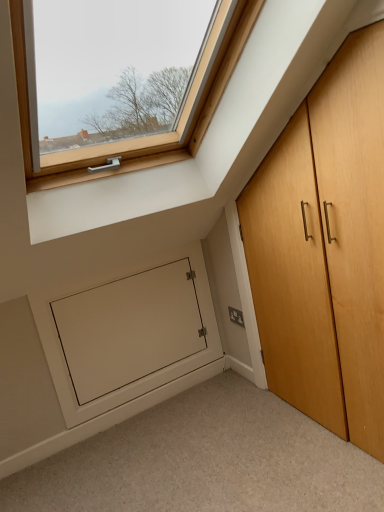
This screenshot has height=512, width=384. Find the location of `satin silver plate at lower right`. satin silver plate at lower right is located at coordinates (236, 316).

Measure the distance between light brown wood cupboard at right and camera.

3.78 feet.

What do you see at coordinates (129, 329) in the screenshot? Image resolution: width=384 pixels, height=512 pixels. I see `white matte door at lower left` at bounding box center [129, 329].

Find the location of a particular element. The height and width of the screenshot is (512, 384). satin silver plate at lower right is located at coordinates (236, 316).

Is white matte door at lower left inside the boundaries of white matte door at lower left, or outside?

white matte door at lower left is outside white matte door at lower left.

Is white matte door at lower left facing towards white matte door at lower left?

No.

Is white matte door at lower left wider or thinner than white matte door at lower left?

In the image, white matte door at lower left appears to be wider than white matte door at lower left.

Does white matte door at lower left have a greater height compared to white matte door at lower left?

No.

Between point (383, 70) and point (234, 308), which one is positioned in front?

The point (383, 70) is closer.

Is light brown wood cupboard at right not close to satin silver plate at lower right?

That's not correct — light brown wood cupboard at right is a little close to satin silver plate at lower right.

Visually, is light brown wood cupboard at right positioned to the left or to the right of satin silver plate at lower right?

light brown wood cupboard at right is to the right of satin silver plate at lower right.

Is light brown wood cupboard at right oriented towards satin silver plate at lower right?

No.

Do you think satin silver plate at lower right is within light brown wood cupboard at right, or outside of it?

satin silver plate at lower right is located beyond the bounds of light brown wood cupboard at right.

From a real-world perspective, which object stands above the other?

light brown wood cupboard at right.

Is satin silver plate at lower right positioned with its back to light brown wood cupboard at right?

No, satin silver plate at lower right's orientation is not away from light brown wood cupboard at right.

Is satin silver plate at lower right to the right of light brown wood cupboard at right from the viewer's perspective?

No.

Find the location of a particular element. This screenshot has width=384, height=512. corridor located underneath the satin silver plate at lower right (from a real-world perspective) is located at coordinates click(205, 461).

From the picture: From a real-world perspective, is white matte door at lower left above or below satin silver plate at lower right?

From a real-world perspective, white matte door at lower left is physically below satin silver plate at lower right.

Would you consider white matte door at lower left to be distant from satin silver plate at lower right?

They are positioned close to each other.

Which object is positioned more to the right, white matte door at lower left or satin silver plate at lower right?

satin silver plate at lower right is more to the right.

Considering the sizes of objects white matte door at lower left and satin silver plate at lower right in the image provided, who is taller, white matte door at lower left or satin silver plate at lower right?

white matte door at lower left.

From the image's perspective, is white matte door at lower left above satin silver plate at lower right?

No.

Looking at their sizes, would you say white matte door at lower left is wider or thinner than satin silver plate at lower right?

white matte door at lower left is thinner than satin silver plate at lower right.

How many degrees apart are the facing directions of satin silver plate at lower right and white matte door at lower left?

90 degrees separate the facing orientations of satin silver plate at lower right and white matte door at lower left.

From a real-world perspective, which object rests below the other?

satin silver plate at lower right, from a real-world perspective.

Which of these two, satin silver plate at lower right or white matte door at lower left, is smaller?

satin silver plate at lower right is smaller.

Where is `electric outlet that appears above the white matte door at lower left (from the image's perspective)`? electric outlet that appears above the white matte door at lower left (from the image's perspective) is located at coordinates (236, 316).

How different are the orientations of white matte door at lower left and light brown wood cupboard at right in degrees?

white matte door at lower left and light brown wood cupboard at right are facing 90 degrees away from each other.

From a real-world perspective, is white matte door at lower left on top of light brown wood cupboard at right?

No.

Is the depth of white matte door at lower left less than that of light brown wood cupboard at right?

No, it is not.

Can light brown wood cupboard at right be found inside white matte door at lower left?

Definitely not — light brown wood cupboard at right is not inside white matte door at lower left.

Find the location of `corridor in front of the white matte door at lower left`. corridor in front of the white matte door at lower left is located at coordinates (205, 461).

Locate an element on the screen. The image size is (384, 512). cupboard on the right of satin silver plate at lower right is located at coordinates (325, 248).

Looking at the image, which one is located closer to white matte door at lower left, light brown wood cupboard at right or satin silver plate at lower right?

The object closer to white matte door at lower left is light brown wood cupboard at right.

Considering their positions, is white matte door at lower left positioned closer to satin silver plate at lower right than light brown wood cupboard at right?

light brown wood cupboard at right is positioned closer to the anchor satin silver plate at lower right.

Based on the photo, from the image, which object appears to be farther from light brown wood cupboard at right, satin silver plate at lower right or white matte door at lower left?

The object further to light brown wood cupboard at right is white matte door at lower left.

Based on their spatial positions, is white matte door at lower left or light brown wood cupboard at right further from white matte door at lower left?

Based on the image, light brown wood cupboard at right appears to be further to white matte door at lower left.

From the image, which object appears to be nearer to satin silver plate at lower right, white matte door at lower left or light brown wood cupboard at right?

The object closer to satin silver plate at lower right is white matte door at lower left.

Considering their positions, is light brown wood cupboard at right positioned further to satin silver plate at lower right than white matte door at lower left?

Based on the image, white matte door at lower left appears to be further to satin silver plate at lower right.

Based on their spatial positions, is satin silver plate at lower right or white matte door at lower left further from white matte door at lower left?

The object further to white matte door at lower left is satin silver plate at lower right.

From the image, which object appears to be nearer to light brown wood cupboard at right, white matte door at lower left or white matte door at lower left?

white matte door at lower left is positioned closer to the anchor light brown wood cupboard at right.

The image size is (384, 512). Find the location of `cupboard located between white matte door at lower left and white matte door at lower left in the depth direction`. cupboard located between white matte door at lower left and white matte door at lower left in the depth direction is located at coordinates (325, 248).

Identify the location of cupboard positioned between white matte door at lower left and satin silver plate at lower right from near to far. (325, 248).

You are a GUI agent. You are given a task and a screenshot of the screen. Output one action in this format:
    pyautogui.click(x=<x>, y=<y>)
    Task: Click on the screen door between light brown wood cupboard at right and satin silver plate at lower right from front to back
    The image size is (384, 512).
    Given the screenshot: What is the action you would take?
    pyautogui.click(x=129, y=329)

At what (x,y) coordinates should I click in order to perform the action: click on screen door between white matte door at lower left and satin silver plate at lower right along the z-axis. Please return your answer as a coordinate pair (x, y). Looking at the image, I should click on (129, 329).